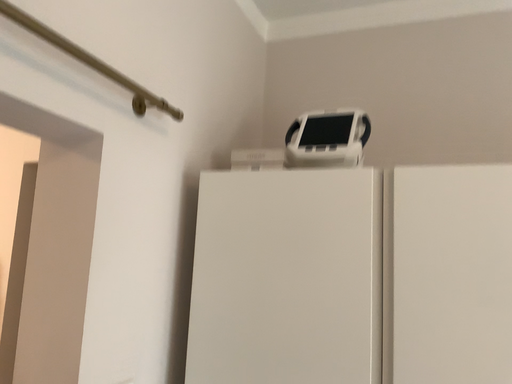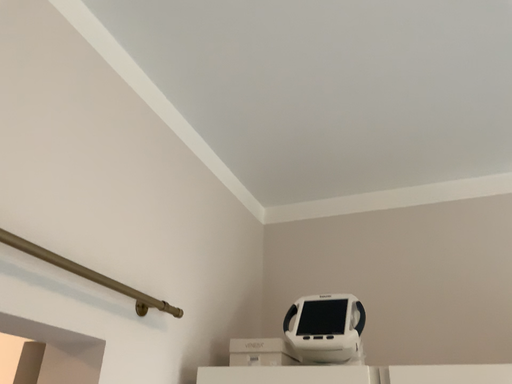
Question: How did the camera likely rotate when shooting the video?

Choices:
 (A) rotated upward
 (B) rotated downward

Answer: (A)